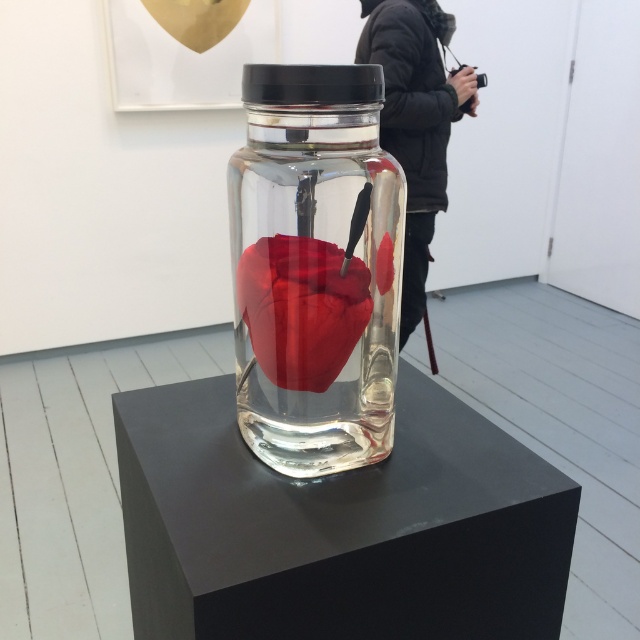
Consider the image. You are an art curator standing in front of the transparent glass jar at center and the black jacket at center. You need to place a protective barrier between them to prevent visitors from touching the artwork. Can you estimate if the barrier, which is 5 feet long, will be sufficient to separate them?

The transparent glass jar at center and black jacket at center are 5.82 feet apart from each other. Since the barrier is only 5 feet long, it will not be sufficient to cover the entire distance between them. You may need a longer barrier or adjust their positions.

You are standing in front of an art installation with two points marked in the scene. The first point is at coordinates point (244, 237) and the second is at point (438, 77). Which point is closer to you?

Point (244, 237) is closer to the viewer than point (438, 77).

You are an art curator examining the installation in the gallery. You need to determine if the black jacket at center can be placed on top of the matte red heart at center without obstructing the view of the heart. Based on their sizes, is this possible?

The black jacket at center has a greater height compared to the matte red heart at center. Since the jacket is taller, placing it on top would likely obstruct the view of the heart.